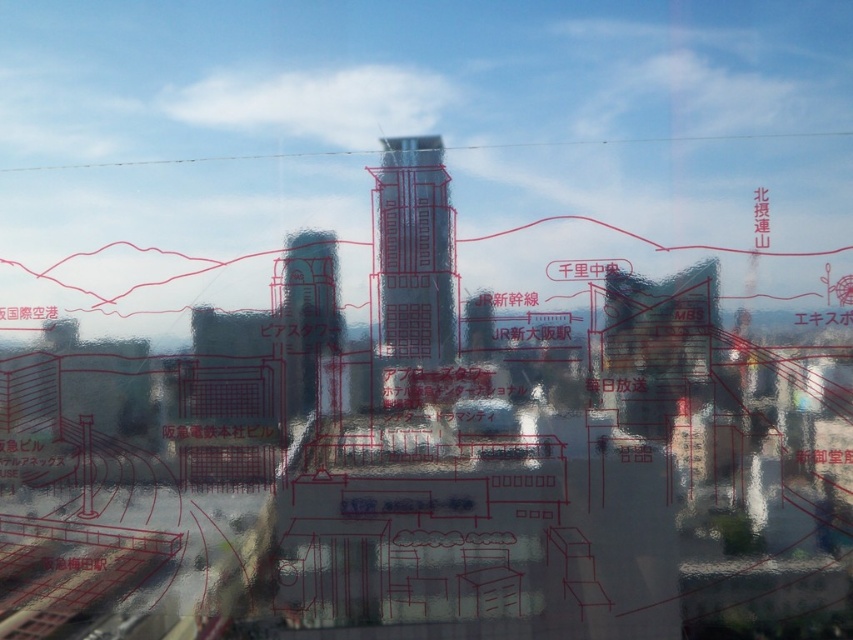
Question: Which point appears farthest from the camera in this image?

Choices:
 (A) (437, 205)
 (B) (292, 412)

Answer: (B)

Question: Which point is closer to the camera taking this photo?

Choices:
 (A) (312, 388)
 (B) (451, 276)

Answer: (B)

Question: Observing the image, what is the correct spatial positioning of matte glass skyscraper at center in reference to transparent glass tower at center?

Choices:
 (A) below
 (B) above

Answer: (B)

Question: Does matte glass skyscraper at center appear on the left side of transparent glass tower at center?

Choices:
 (A) yes
 (B) no

Answer: (B)

Question: Does matte glass skyscraper at center have a larger size compared to transparent glass tower at center?

Choices:
 (A) yes
 (B) no

Answer: (A)